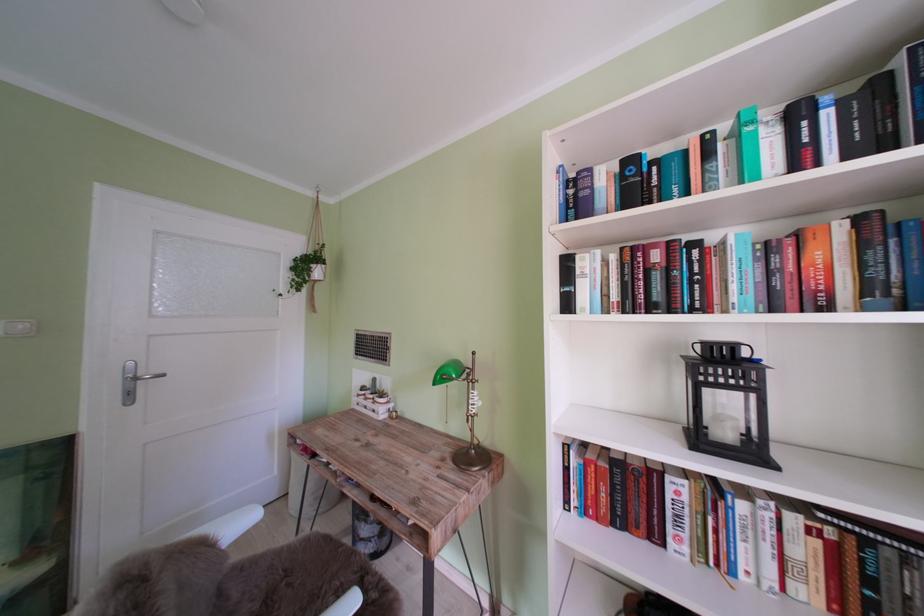
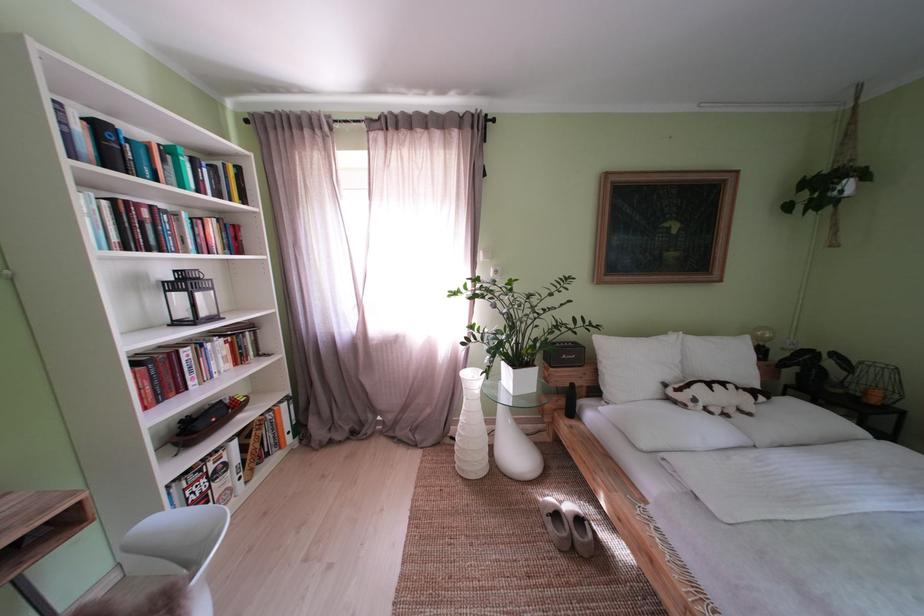
Find the pixel in the second image that matches point (735, 248) in the first image.

(188, 220)